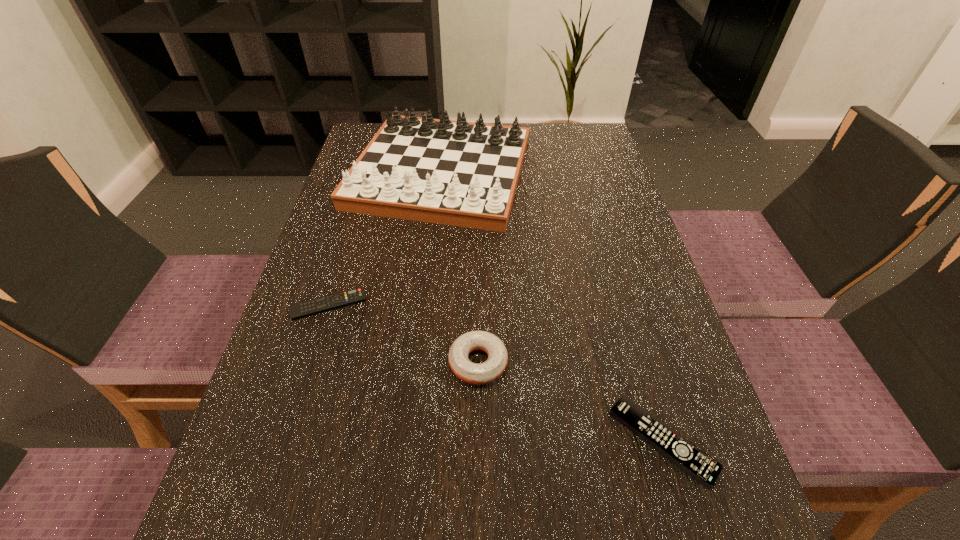
This screenshot has width=960, height=540. Identify the location of vacant space located on the back of the taller remote control. (614, 280).

You are a GUI agent. You are given a task and a screenshot of the screen. Output one action in this format:
    pyautogui.click(x=<x>, y=<y>)
    Task: Click on the vacant space located 0.350m on the front of the shorter remote control
    Image resolution: width=960 pixels, height=540 pixels.
    Given the screenshot: What is the action you would take?
    pyautogui.click(x=260, y=523)

Identify the location of object that is at the far edge. (458, 173).

You are a GUI agent. You are given a task and a screenshot of the screen. Output one action in this format:
    pyautogui.click(x=<x>, y=<y>)
    Task: Click on the gameboard that is positioned at the left edge
    The width and height of the screenshot is (960, 540).
    Given the screenshot: What is the action you would take?
    pyautogui.click(x=458, y=173)

Where is `remote control at the left edge`? The image size is (960, 540). remote control at the left edge is located at coordinates (315, 306).

This screenshot has height=540, width=960. Find the location of `object that is at the right edge`. object that is at the right edge is located at coordinates (689, 458).

Identify the location of object that is at the far left corner. The image size is (960, 540). (458, 173).

I want to click on vacant region at the far edge of the desktop, so click(529, 148).

Locate an element on the screen. The height and width of the screenshot is (540, 960). free space at the left edge of the desktop is located at coordinates 378,272.

Locate an element on the screen. The width and height of the screenshot is (960, 540). vacant point at the right edge is located at coordinates (613, 180).